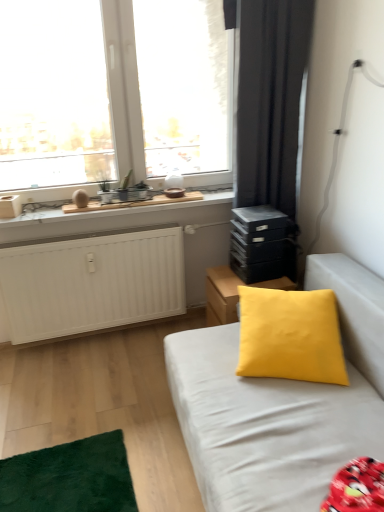
Question: Considering the relative sizes of transparent glass window at upper left and yellow matte pillow at center in the image provided, is transparent glass window at upper left smaller than yellow matte pillow at center?

Choices:
 (A) yes
 (B) no

Answer: (A)

Question: Is yellow matte pillow at center a part of transparent glass window at upper left?

Choices:
 (A) yes
 (B) no

Answer: (B)

Question: Is transparent glass window at upper left positioned beyond the bounds of yellow matte pillow at center?

Choices:
 (A) no
 (B) yes

Answer: (B)

Question: Is transparent glass window at upper left facing away from yellow matte pillow at center?

Choices:
 (A) yes
 (B) no

Answer: (B)

Question: Could you tell me if transparent glass window at upper left is turned towards yellow matte pillow at center?

Choices:
 (A) no
 (B) yes

Answer: (A)

Question: Is transparent glass window at upper left directly adjacent to yellow matte pillow at center?

Choices:
 (A) yes
 (B) no

Answer: (B)

Question: From the image's perspective, is yellow matte pillow at center over black matte curtain at upper right?

Choices:
 (A) yes
 (B) no

Answer: (B)

Question: From the image's perspective, is yellow matte pillow at center under black matte curtain at upper right?

Choices:
 (A) yes
 (B) no

Answer: (A)

Question: Is yellow matte pillow at center to the right of black matte curtain at upper right from the viewer's perspective?

Choices:
 (A) yes
 (B) no

Answer: (A)

Question: Is the position of yellow matte pillow at center more distant than that of black matte curtain at upper right?

Choices:
 (A) no
 (B) yes

Answer: (A)

Question: Is yellow matte pillow at center wider than black matte curtain at upper right?

Choices:
 (A) no
 (B) yes

Answer: (B)

Question: Does yellow matte pillow at center turn towards black matte curtain at upper right?

Choices:
 (A) no
 (B) yes

Answer: (A)

Question: Could you tell me if black matte stack of drawers at right is turned towards black matte curtain at upper right?

Choices:
 (A) yes
 (B) no

Answer: (B)